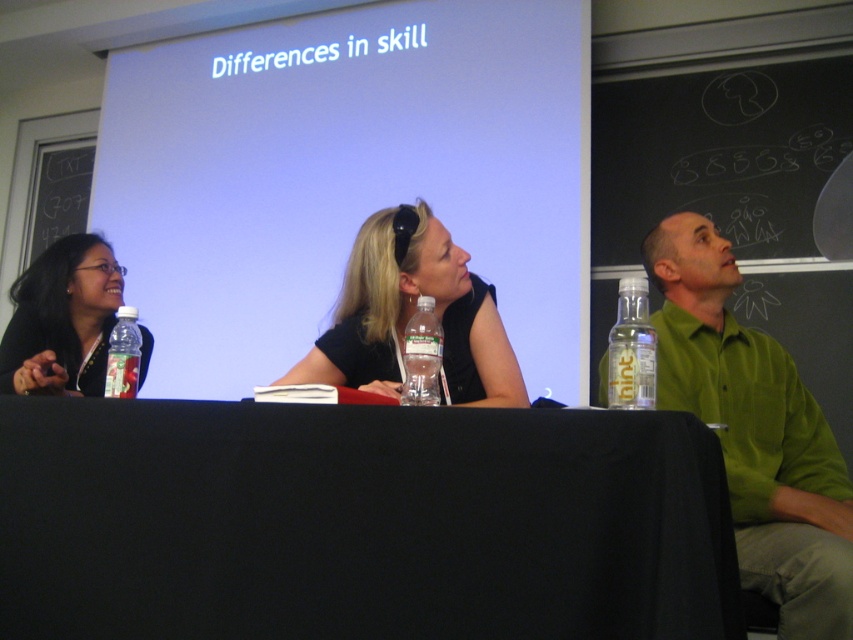
Question: Considering the real-world distances, which object is closest to the matte black hair at left?

Choices:
 (A) black matte shirt at center
 (B) black fabric table at center
 (C) green matte shirt at right

Answer: (A)

Question: Does black matte shirt at center come in front of clear plastic bottle at center?

Choices:
 (A) yes
 (B) no

Answer: (B)

Question: Is the position of clear plastic bottle at right more distant than that of clear plastic bottle at center?

Choices:
 (A) no
 (B) yes

Answer: (A)

Question: Does black fabric table at center have a smaller size compared to clear plastic bottle at right?

Choices:
 (A) yes
 (B) no

Answer: (B)

Question: Which of the following is the closest to the observer?

Choices:
 (A) clear plastic bottle at center
 (B) translucent plastic bottle at table left

Answer: (A)

Question: Which of the following is the closest to the observer?

Choices:
 (A) click(125, 346)
 (B) click(643, 353)

Answer: (B)